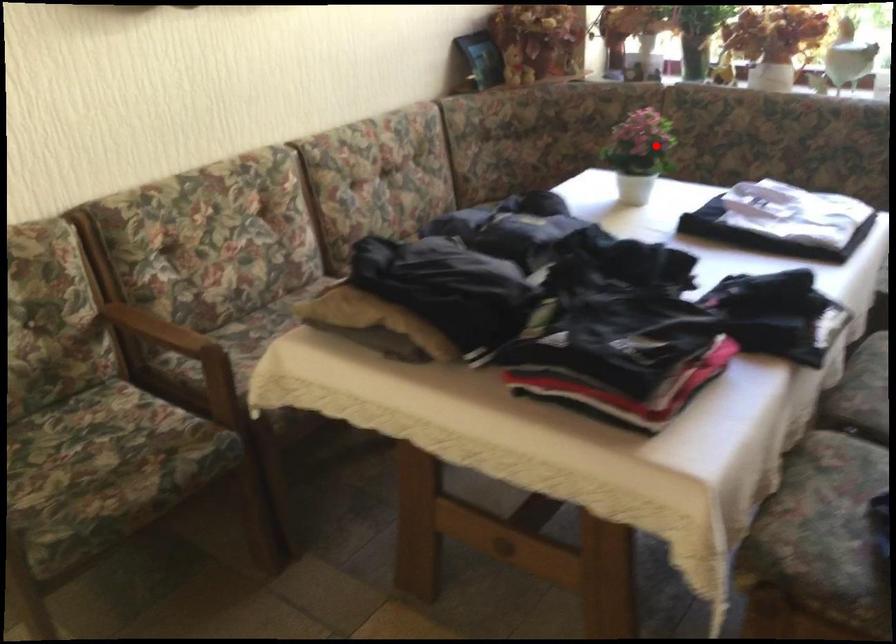
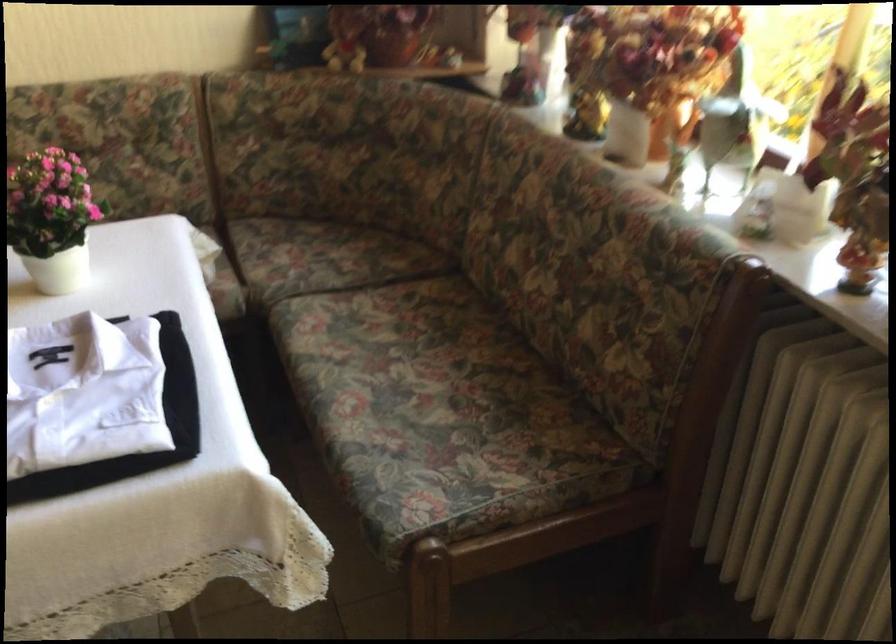
Find the pixel in the second image that matches the highlighted location in the first image.

(52, 218)